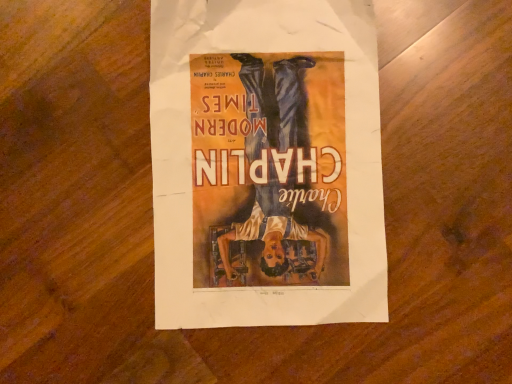
Find the location of a particular element. The image size is (512, 384). vacant point above matte paper poster at center (from a real-world perspective) is located at coordinates (266, 164).